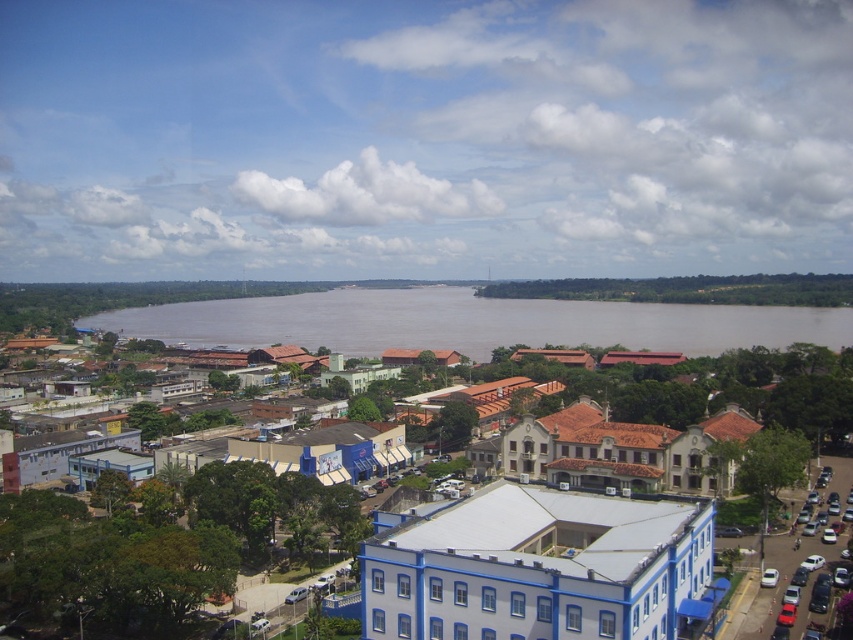
You are a city planner reviewing this town layout. You need to determine if the white matte building at center can be expanded to the same width as the brown muddy water at center. Based on the scene description, is this possible without altering the river? Please explain.

The white matte building at center is thinner than brown muddy water at center. Therefore, expanding the building to match the width of the brown muddy water at center would be possible without altering the river, as there is existing space available.

You are standing at the point with coordinates (692,435) in the town. What is the nearest building to you?

The point at (692,435) corresponds to the white matte building at center, so the nearest building to you is the white matte building at center.

You are a city planner assessing the town layout. You need to determine if the white matte building at center can be expanded towards the brown muddy water at center. Based on their sizes, is this feasible?

The white matte building at center is smaller than brown muddy water at center, so expanding the building towards the brown muddy water at center may be possible as there is sufficient space available.